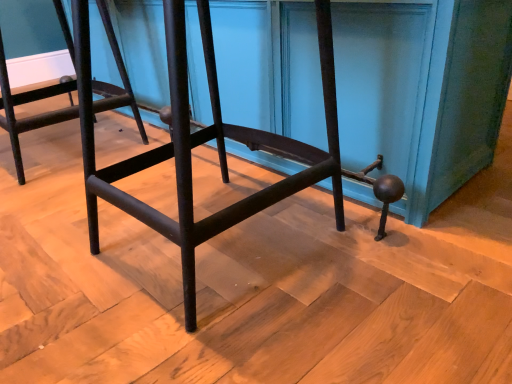
I want to click on free space in front of matte black stool at center, so click(x=229, y=337).